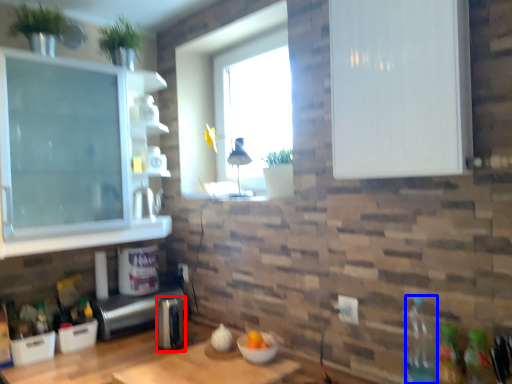
Question: Which point is closer to the camera, appliance (highlighted by a red box) or bottle (highlighted by a blue box)?

Choices:
 (A) appliance
 (B) bottle

Answer: (B)